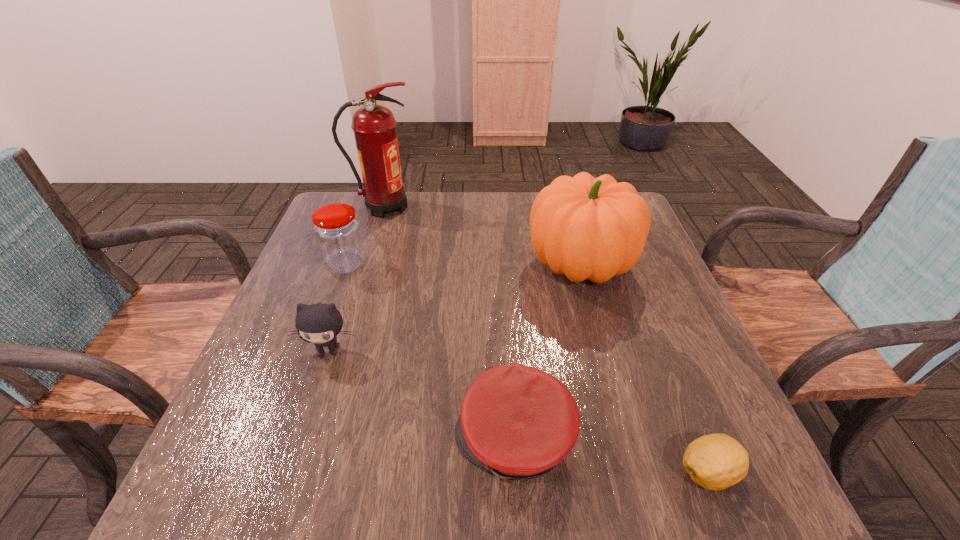
Image resolution: width=960 pixels, height=540 pixels. In order to click on cap present at the near edge in this screenshot , I will do `click(518, 422)`.

Where is `lemon located in the near edge section of the desktop`? Image resolution: width=960 pixels, height=540 pixels. lemon located in the near edge section of the desktop is located at coordinates (717, 461).

At what (x,y) coordinates should I click in order to perform the action: click on fire extinguisher positioned at the left edge. Please return your answer as a coordinate pair (x, y). The height and width of the screenshot is (540, 960). Looking at the image, I should click on (374, 126).

In order to click on jar located in the left edge section of the desktop in this screenshot , I will do `click(337, 230)`.

At what (x,y) coordinates should I click in order to perform the action: click on kitten that is at the left edge. Please return your answer as a coordinate pair (x, y). Looking at the image, I should click on (319, 323).

Locate an element on the screen. The image size is (960, 540). pumpkin that is at the right edge is located at coordinates coord(591,228).

Locate an element on the screen. This screenshot has height=540, width=960. lemon present at the right edge is located at coordinates (717, 461).

Find the location of a particular element. object that is positioned at the far left corner is located at coordinates (374, 126).

Locate an element on the screen. The height and width of the screenshot is (540, 960). object that is at the far right corner is located at coordinates (591, 228).

Locate an element on the screen. object present at the near right corner is located at coordinates (717, 461).